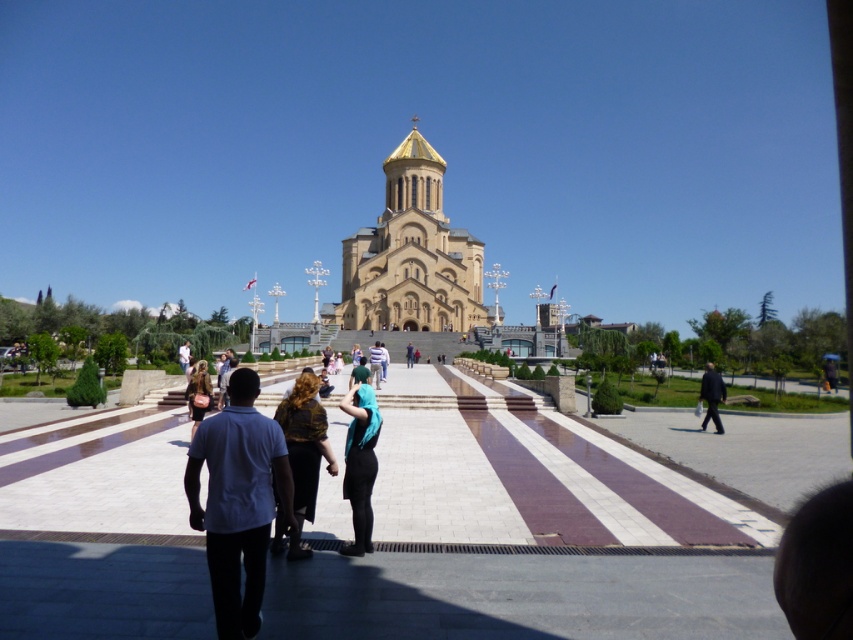
You are standing at the entrance of the beige stone church at center. You want to walk to the nearest exit located at point 0.518, 0.591. Can you reach it without crossing the striped pathway?

The beige stone church at center is located at point (410, 256). The exit is at (503, 331). Since the striped pathway is in front of the church, you can walk around the sides of the church to reach the exit without crossing the pathway.

You are standing at the point marked as point (410, 256). What can you see directly in front of you?

You can see the beige stone church at center directly in front of you at point (410, 256).